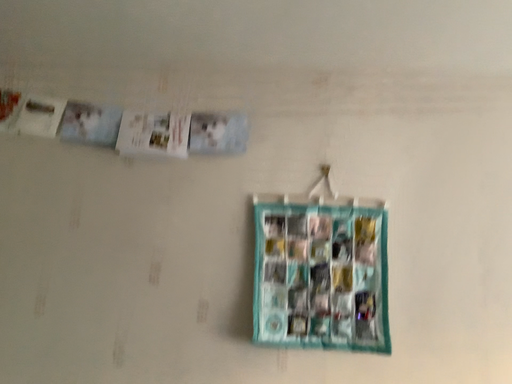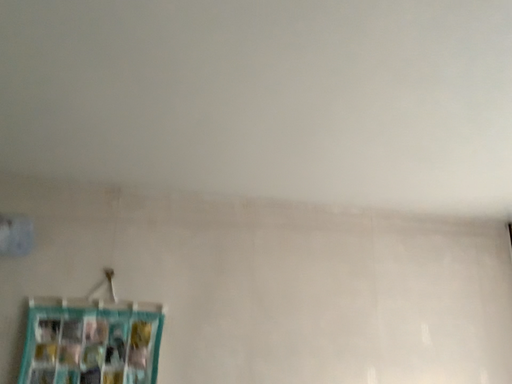
Question: How did the camera likely rotate when shooting the video?

Choices:
 (A) rotated downward
 (B) rotated upward

Answer: (B)